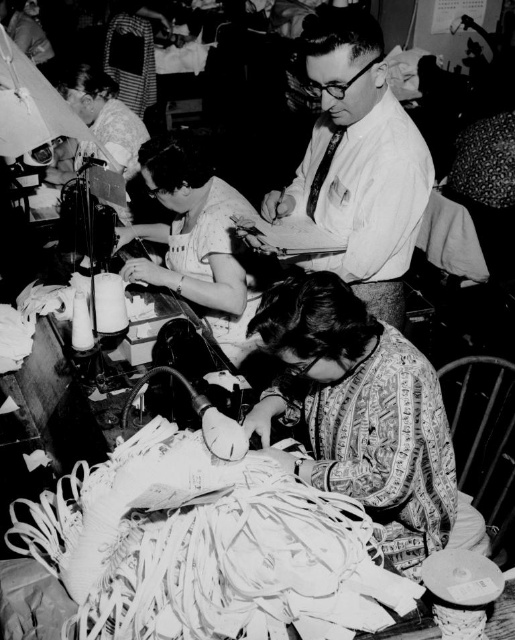
Is white shirt at center smaller than matte fabric dress at center?

Actually, white shirt at center might be larger than matte fabric dress at center.

Which is behind, point (352, 131) or point (229, 268)?

The point (229, 268) is behind.

Find the location of a particular element. white shirt at center is located at coordinates (358, 161).

Is patterned fabric at lower center to the left of white shirt at center from the viewer's perspective?

Correct, you'll find patterned fabric at lower center to the left of white shirt at center.

Describe the element at coordinates (359, 412) in the screenshot. I see `patterned fabric at lower center` at that location.

Is point (272, 353) positioned behind point (409, 262)?

No, (272, 353) is closer to viewer.

Identify the location of patterned fabric at lower center. Image resolution: width=515 pixels, height=640 pixels. (359, 412).

Does point (422, 476) come closer to viewer compared to point (163, 157)?

Yes.

Is patterned fabric at lower center bigger than matte fabric dress at center?

No.

Describe the element at coordinates (359, 412) in the screenshot. I see `patterned fabric at lower center` at that location.

Find the location of a particular element. patterned fabric at lower center is located at coordinates 359,412.